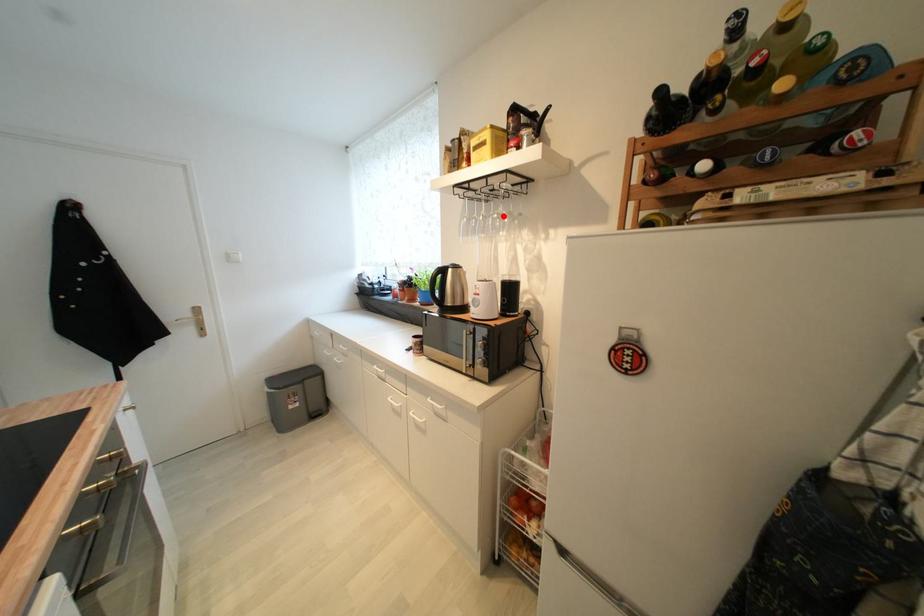
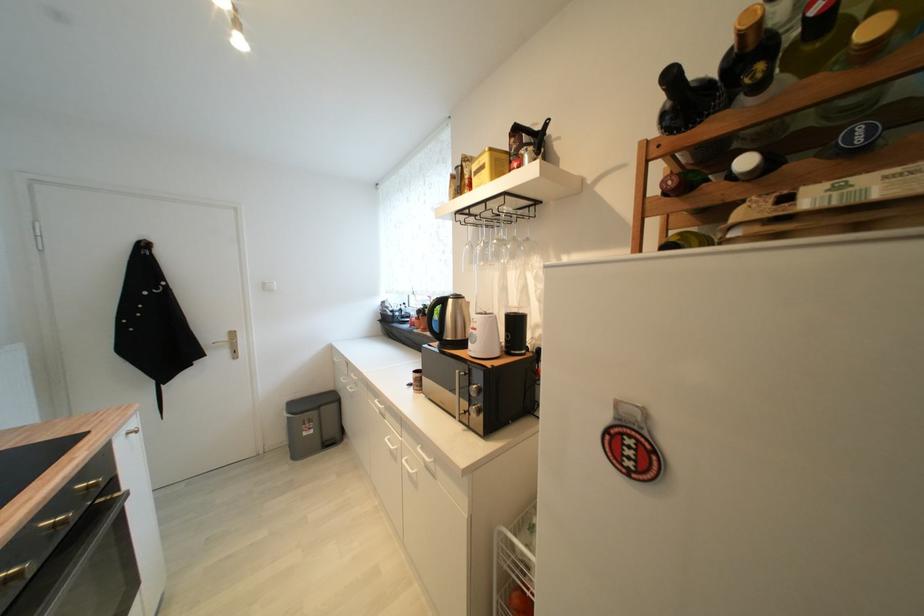
Find the pixel in the second image that matches the highlighted location in the first image.

(504, 241)